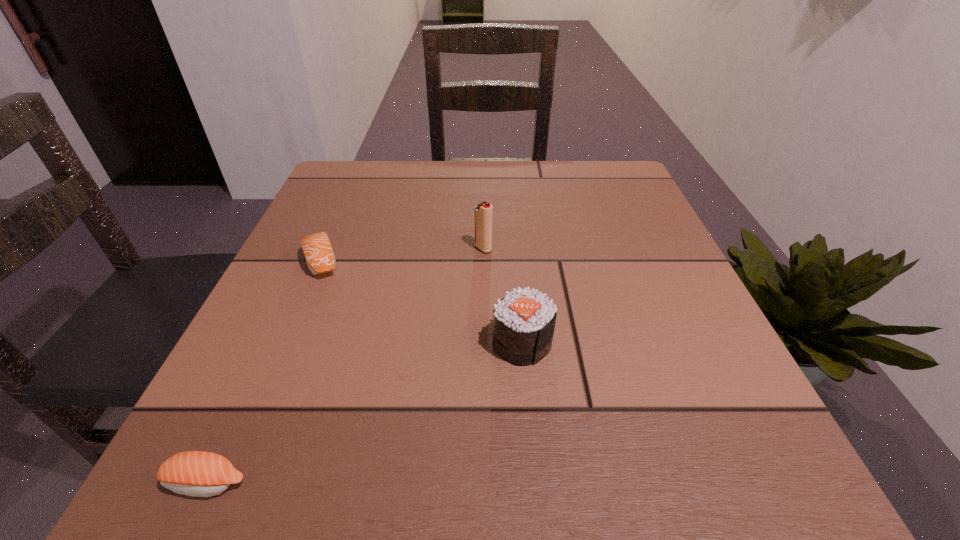
At what (x,y) coordinates should I click in order to perform the action: click on sushi that is the closest to the tallest object. Please return your answer as a coordinate pair (x, y). This screenshot has height=540, width=960. Looking at the image, I should click on (524, 320).

Identify the location of free space that satisfies the following two spatial constraints: 1. on the front side of the tallest object; 2. on the left side of the tallest sushi. (484, 343).

The width and height of the screenshot is (960, 540). Find the location of `free space that satisfies the following two spatial constraints: 1. on the back side of the farthest sushi; 2. on the left side of the nearest object`. free space that satisfies the following two spatial constraints: 1. on the back side of the farthest sushi; 2. on the left side of the nearest object is located at coordinates (309, 261).

Image resolution: width=960 pixels, height=540 pixels. Identify the location of free location that satisfies the following two spatial constraints: 1. on the back side of the nearest sushi; 2. on the left side of the second tallest object. (272, 343).